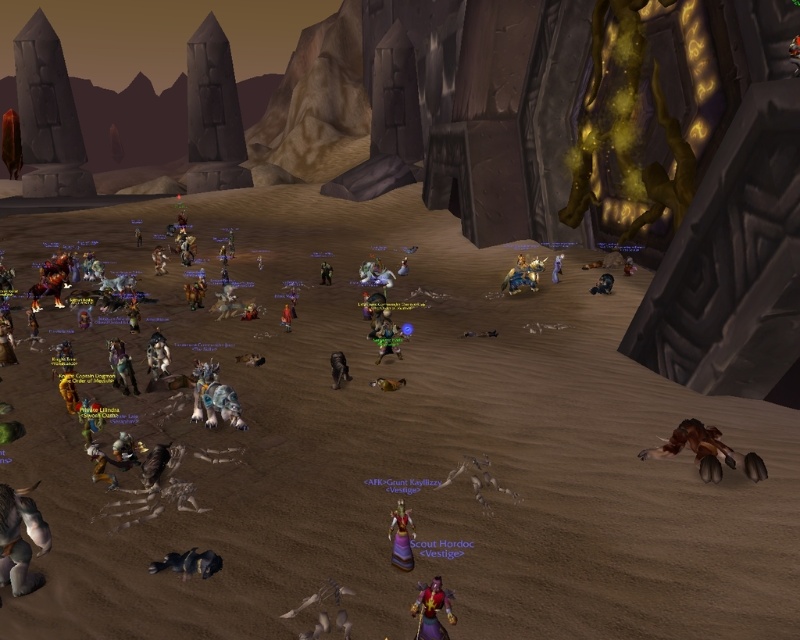
You are a player in this MMORPG scene. You need to pick up an item but can only reach items within 2 meters. The shiny red armor at bottom center and the shiny black toy at lower left are both on the ground. Which item can you reach if you are standing at the center of the image?

The shiny black toy at lower left is smaller than the shiny red armor at bottom center. Since the toy is smaller, it might be closer to you. However, without knowing their exact distances, we cannot determine reachability based on size alone. The question requires knowing which is closer, but the provided description only states size difference. Thus, the correct answer should point out that the description doesn

You are a player in this MMORPG scene. You need to decide which object is wider when comparing the shiny red armor at bottom center and the shiny black toy at lower left. Which one is wider?

The shiny black toy at lower left is wider than the shiny red armor at bottom center.

In this MMORPG scene, you see a shiny silver sword at center right and a green fabric doll at center. Which object is positioned more to the east? Please answer based on the scene orientation where the sun is setting in the west.

The shiny silver sword at center right is positioned to the right of the green fabric doll at center. Since the sun is setting in the west, the right side of the image corresponds to the east direction. Therefore, the shiny silver sword at center right is more to the east.